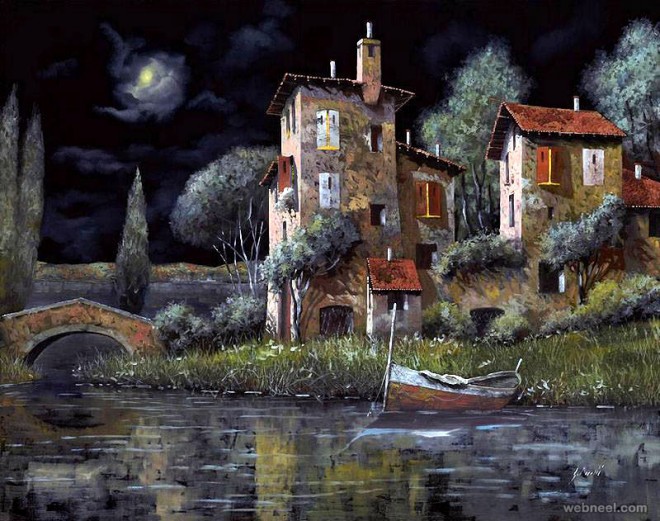
Locate an element on the screen. The width and height of the screenshot is (660, 521). painting is located at coordinates (346, 262).